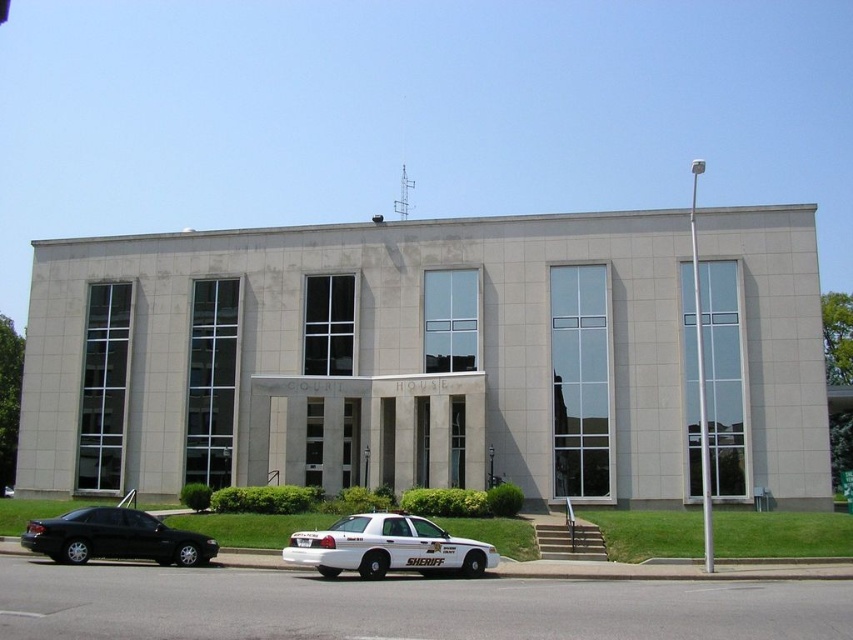
Can you confirm if white glossy police car at center is thinner than matte black sedan at lower left?

Correct, white glossy police car at center's width is less than matte black sedan at lower left's.

You are a GUI agent. You are given a task and a screenshot of the screen. Output one action in this format:
    pyautogui.click(x=<x>, y=<y>)
    Task: Click on the white glossy police car at center
    
    Given the screenshot: What is the action you would take?
    pyautogui.click(x=387, y=547)